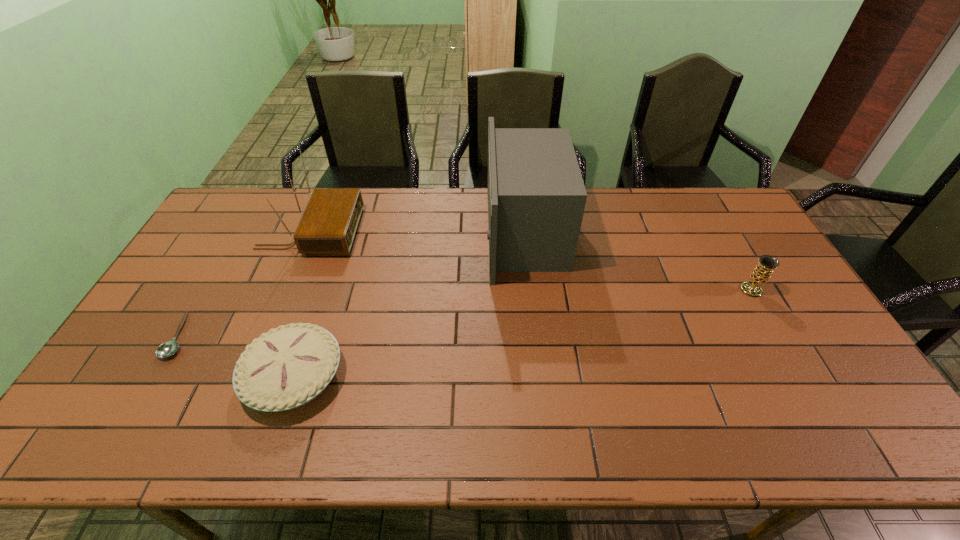
Identify the location of free region located 0.380m on the front panel of the radio_receiver. (469, 233).

This screenshot has width=960, height=540. Find the location of `free space located 0.170m on the left of the third shortest object`. free space located 0.170m on the left of the third shortest object is located at coordinates (684, 290).

Where is `blank space located 0.110m on the back of the pie`? Image resolution: width=960 pixels, height=540 pixels. blank space located 0.110m on the back of the pie is located at coordinates (318, 305).

The width and height of the screenshot is (960, 540). Identify the location of free space located 0.310m on the right of the ladle. (303, 335).

Locate an element on the screen. The width and height of the screenshot is (960, 540). microwave oven present at the far edge is located at coordinates (536, 195).

Where is `radio_receiver present at the far edge`? The height and width of the screenshot is (540, 960). radio_receiver present at the far edge is located at coordinates (328, 225).

Locate an element on the screen. object that is at the near edge is located at coordinates (287, 367).

Locate an element on the screen. The width and height of the screenshot is (960, 540). object present at the left edge is located at coordinates (167, 349).

Where is `object that is at the right edge`? Image resolution: width=960 pixels, height=540 pixels. object that is at the right edge is located at coordinates (762, 272).

Locate an element on the screen. The image size is (960, 540). vacant space at the far edge of the desktop is located at coordinates (401, 213).